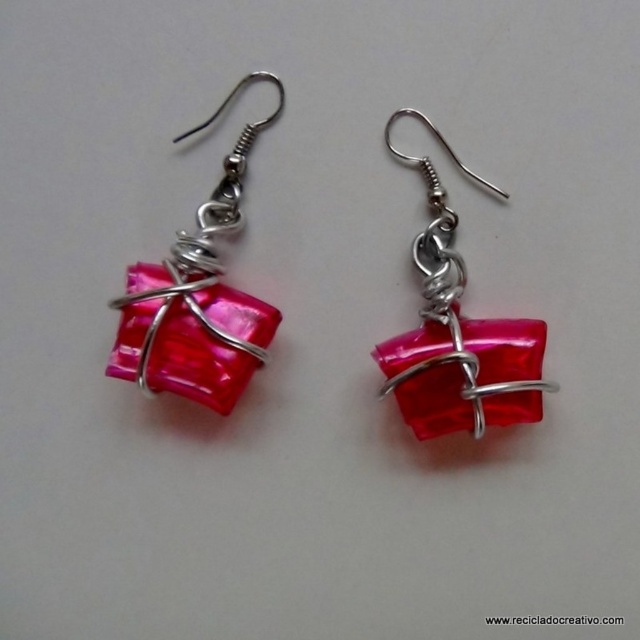
Between pink glossy cube at center and glossy red cube at center, which one is positioned higher?

pink glossy cube at center

Which is more to the right, pink glossy cube at center or glossy red cube at center?

Positioned to the right is glossy red cube at center.

Where is `pink glossy cube at center`? The width and height of the screenshot is (640, 640). pink glossy cube at center is located at coordinates (196, 298).